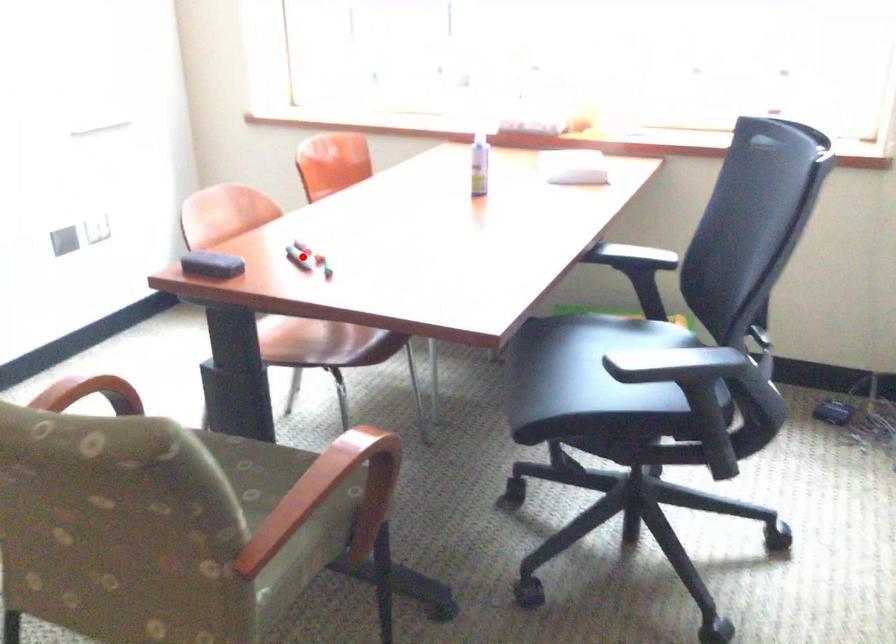
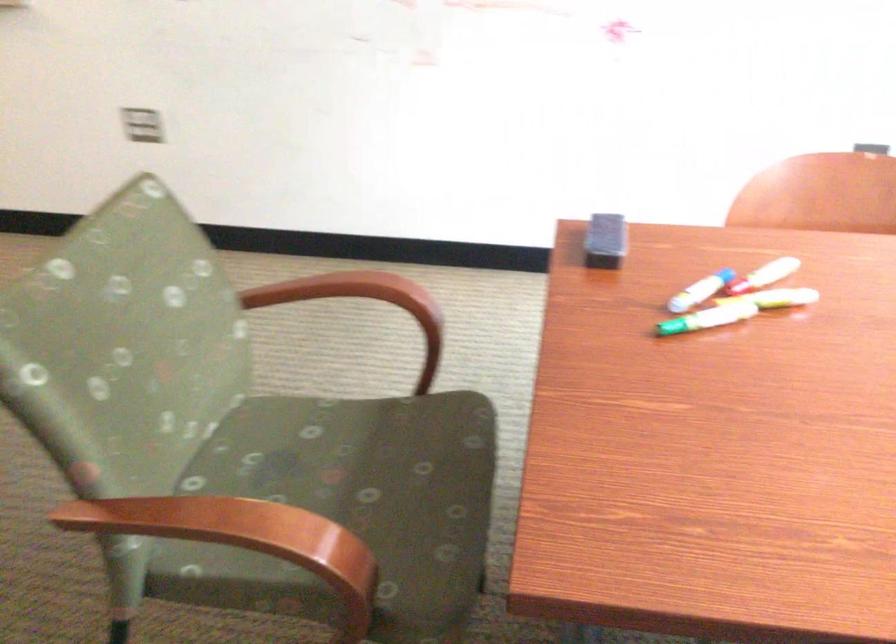
Locate, in the second image, the point that corresponds to the highlighted location in the first image.

(700, 290)